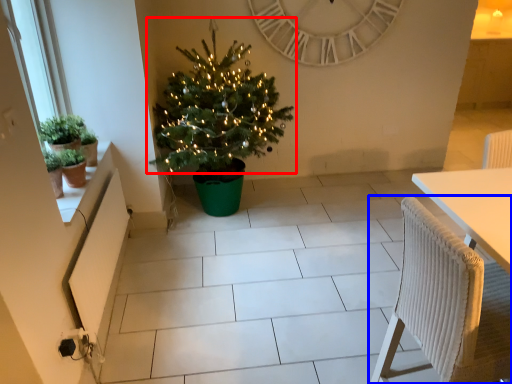
Question: Among these objects, which one is farthest to the camera, christmas tree (highlighted by a red box) or chair (highlighted by a blue box)?

Choices:
 (A) christmas tree
 (B) chair

Answer: (A)